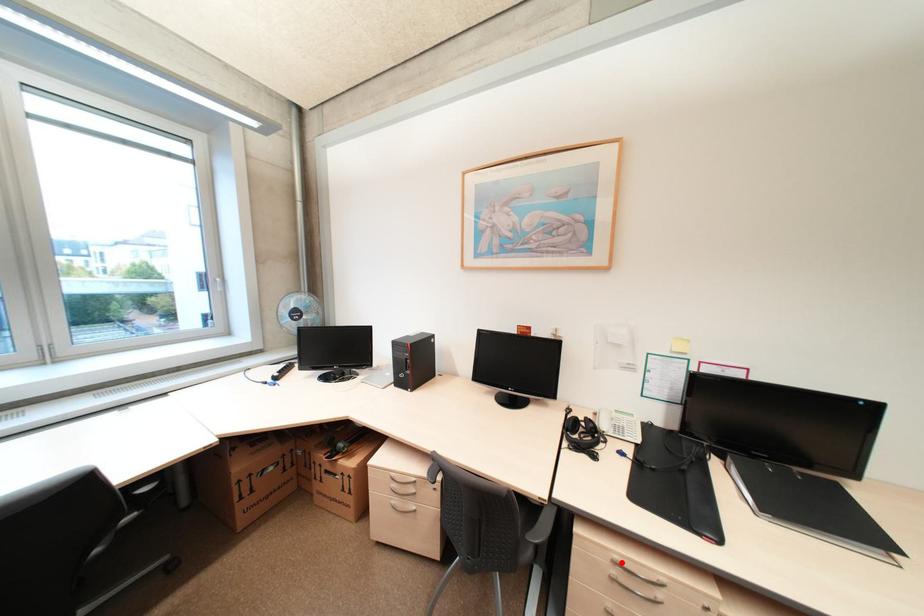
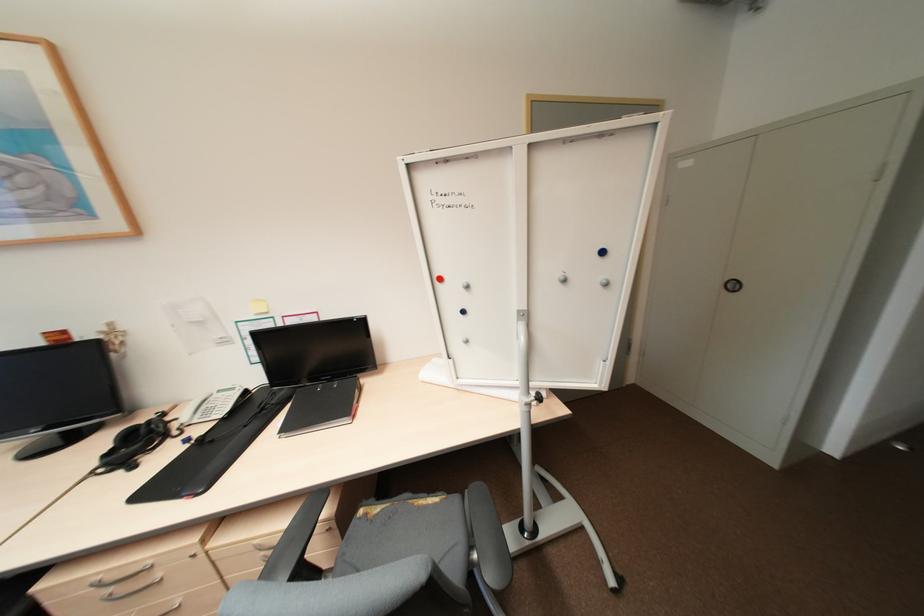
Question: I am providing you with two images of the same scene from different viewpoints. Image1 has a red point marked. In image2, the corresponding 3D location appears at what relative position? Reply with the corresponding letter.

Choices:
 (A) Closer
 (B) Farther

Answer: (A)